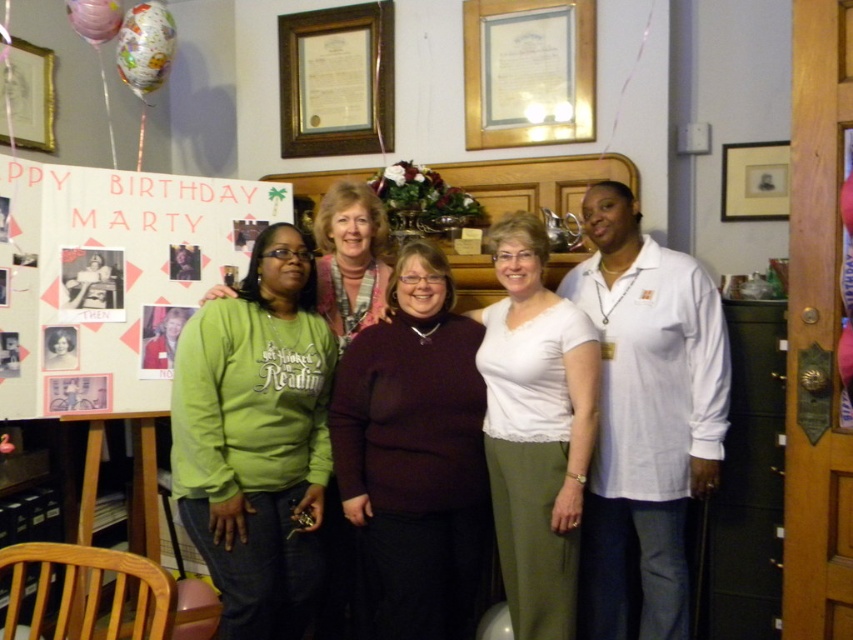
Question: Can you confirm if green sweatshirt at center is positioned to the left of maroon sweater at center?

Choices:
 (A) no
 (B) yes

Answer: (A)

Question: Does green matte sweatshirt at left appear over maroon sweater at center?

Choices:
 (A) no
 (B) yes

Answer: (B)

Question: Which object is the closest to the white paperboard at left?

Choices:
 (A) green sweatshirt at center
 (B) maroon sweater at center

Answer: (B)

Question: Considering the real-world distances, which object is farthest from the maroon sweater at center?

Choices:
 (A) green matte sweatshirt at left
 (B) green sweatshirt at center
 (C) white matte shirt at center

Answer: (B)

Question: Is maroon sweater at center further to the viewer compared to white matte shirt at center?

Choices:
 (A) no
 (B) yes

Answer: (B)

Question: Among these points, which one is farthest from the camera?

Choices:
 (A) (531, 340)
 (B) (611, 266)

Answer: (B)